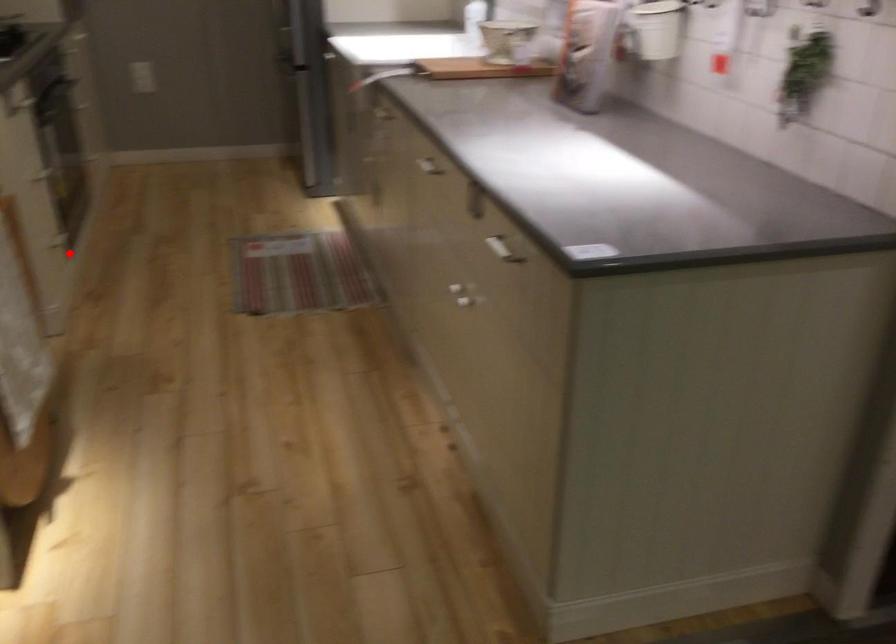
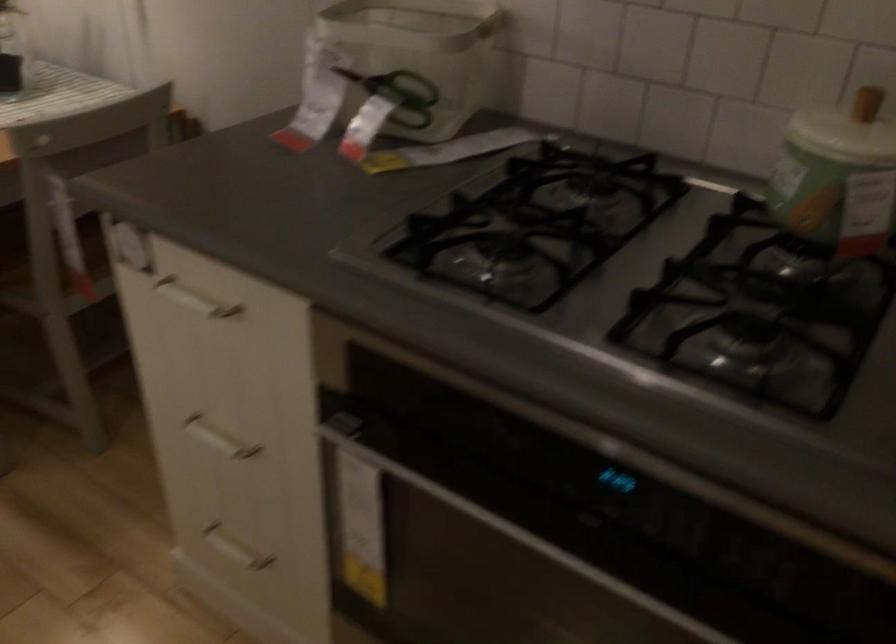
Where in the second image is the point corresponding to the highlighted location from the first image?

(234, 549)